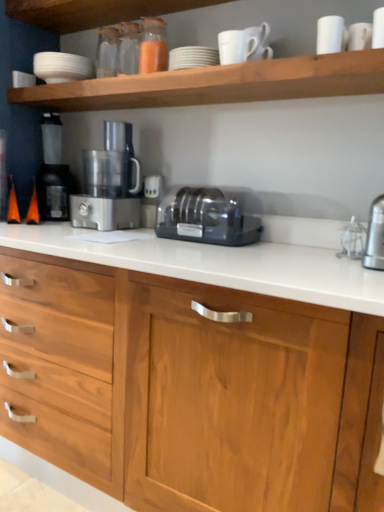
Question: From their relative heights in the image, would you say white matte shelf at upper center is taller or shorter than white matte cup at upper right, which is the 2th tableware in left-to-right order?

Choices:
 (A) short
 (B) tall

Answer: (A)

Question: Based on their sizes in the image, would you say white matte shelf at upper center is bigger or smaller than white matte cup at upper right, placed as the 1th tableware when sorted from front to back?

Choices:
 (A) small
 (B) big

Answer: (B)

Question: Which of these objects is positioned farthest from the translucent glass spice at upper center?

Choices:
 (A) white matte cup at upper right, marked as the 1th tableware in a bottom-to-top arrangement
 (B) wooden cabinet at center
 (C) black plastic toaster at center
 (D) black plastic coffee machine at left
 (E) white matte bowl at upper left, which is counted as the 2th tableware, starting from the right

Answer: (B)

Question: Which is nearer to the black plastic toaster at center?

Choices:
 (A) black plastic coffee machine at left
 (B) white matte bowl at upper left, which is counted as the 2th tableware, starting from the right
 (C) wooden cabinet at center
 (D) satin silver food processor at center
 (E) white matte shelf at upper center

Answer: (D)